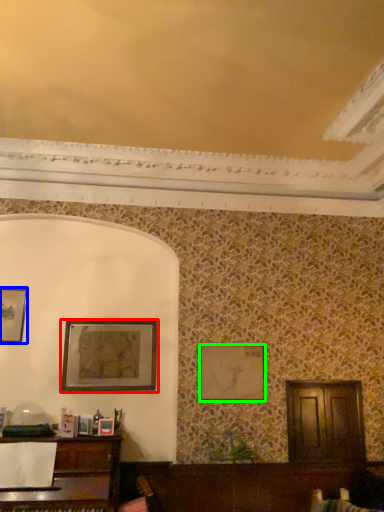
Question: Considering the real-world distances, which object is closest to picture frame (highlighted by a red box)? picture frame (highlighted by a blue box) or picture frame (highlighted by a green box).

Choices:
 (A) picture frame
 (B) picture frame

Answer: (A)